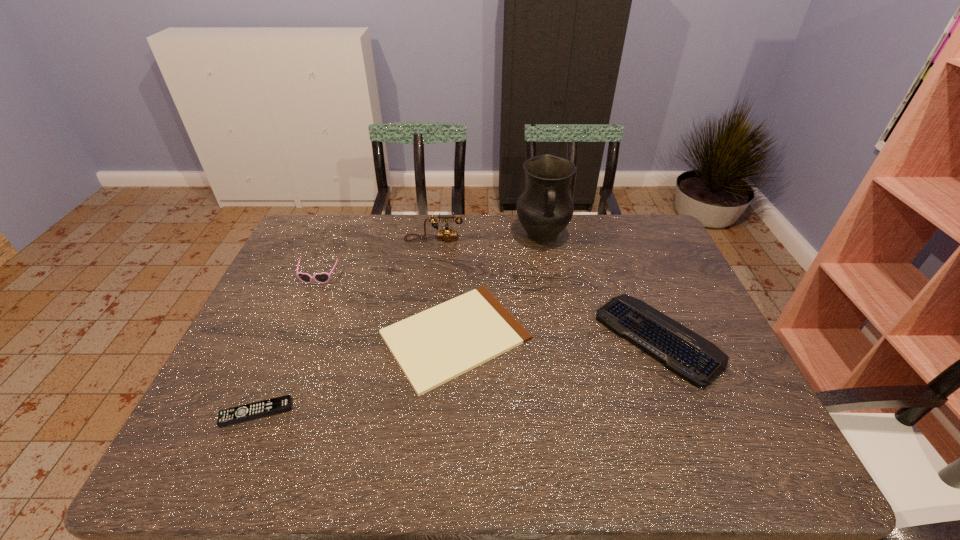
Identify the location of free space located on the front-facing side of the fifth shortest object. (430, 268).

At what (x,y) coordinates should I click in order to perform the action: click on vacant space located 0.240m on the front-facing side of the sunglasses. Please return your answer as a coordinate pair (x, y). Looking at the image, I should click on (288, 348).

This screenshot has height=540, width=960. What are the coordinates of `free region located on the left of the computer keyboard` in the screenshot? It's located at (536, 338).

Where is `vacant space located 0.160m on the right of the nearest object`? The height and width of the screenshot is (540, 960). vacant space located 0.160m on the right of the nearest object is located at coordinates (362, 412).

Identify the location of free point located on the right of the shortest object. (623, 336).

Locate an element on the screen. This screenshot has width=960, height=540. pitcher at the far edge is located at coordinates (545, 208).

Where is `telephone that is at the far edge`? telephone that is at the far edge is located at coordinates (446, 234).

At what (x,y) coordinates should I click in order to perform the action: click on sunglasses located at the left edge. Please return your answer as a coordinate pair (x, y). The height and width of the screenshot is (540, 960). Looking at the image, I should click on (324, 277).

Identify the location of remote control at the left edge. (255, 410).

Where is `object that is at the right edge`? The width and height of the screenshot is (960, 540). object that is at the right edge is located at coordinates (685, 353).